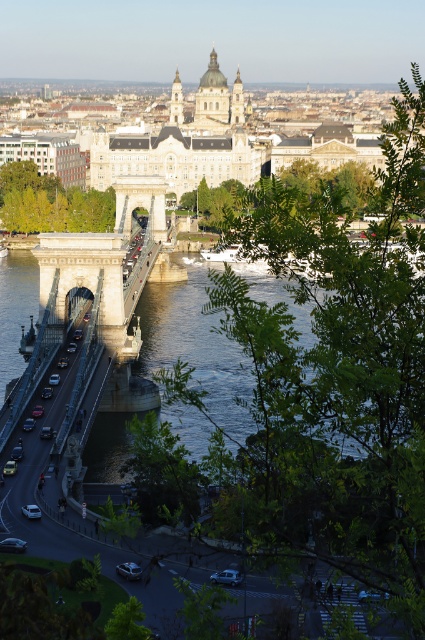
Consider the image. Can you confirm if metallic chain-link bridge at center is positioned to the left of matte silver car at lower left?

Correct, you'll find metallic chain-link bridge at center to the left of matte silver car at lower left.

Can you confirm if metallic chain-link bridge at center is thinner than matte silver car at lower left?

In fact, metallic chain-link bridge at center might be wider than matte silver car at lower left.

What do you see at coordinates (107, 260) in the screenshot? This screenshot has width=425, height=640. I see `metallic chain-link bridge at center` at bounding box center [107, 260].

This screenshot has height=640, width=425. In order to click on metallic chain-link bridge at center in this screenshot , I will do pyautogui.click(x=107, y=260).

Between point (235, 570) and point (127, 561), which one is positioned in front?

Point (235, 570) is more forward.

Which is more to the left, silver metallic car at lower center or matte silver car at lower left?

Positioned to the left is matte silver car at lower left.

Identify the location of silver metallic car at lower center. This screenshot has height=640, width=425. (226, 577).

Where is `silver metallic car at lower center`? This screenshot has height=640, width=425. silver metallic car at lower center is located at coordinates (226, 577).

Who is positioned more to the left, silver metallic car at lower center or shiny silver car at left?

shiny silver car at left

Who is more forward, [227,577] or [56,381]?

Point [227,577] is more forward.

The width and height of the screenshot is (425, 640). Find the location of `silver metallic car at lower center`. silver metallic car at lower center is located at coordinates (226, 577).